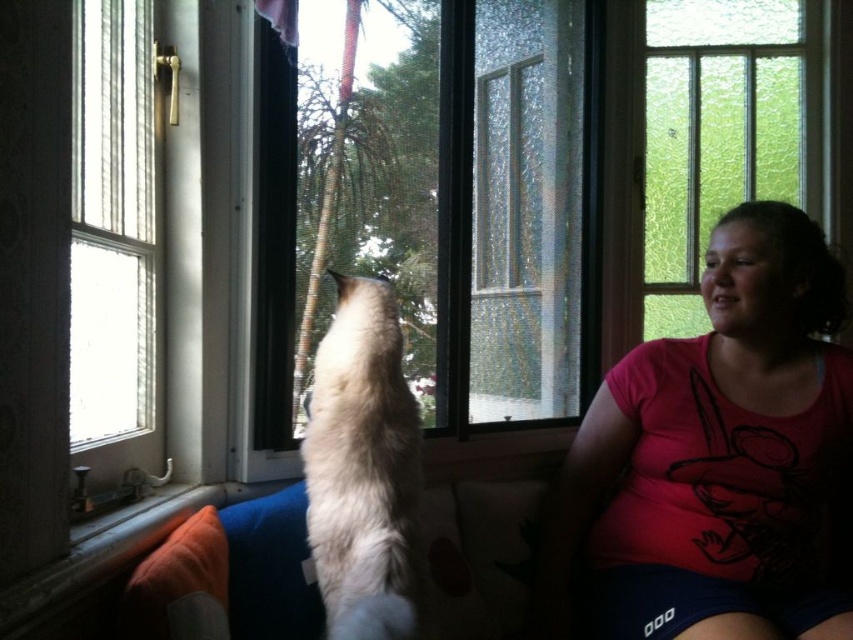
Question: Can you confirm if transparent glass window at center is wider than clear glass window at left?

Choices:
 (A) no
 (B) yes

Answer: (B)

Question: Which point is farther to the camera?

Choices:
 (A) pink cotton shirt at right
 (B) transparent glass window at center
 (C) white fluffy cat at center

Answer: (B)

Question: Does pink cotton shirt at right appear on the left side of white fluffy cat at center?

Choices:
 (A) yes
 (B) no

Answer: (B)

Question: Is transparent glass window at center smaller than white fluffy cat at center?

Choices:
 (A) no
 (B) yes

Answer: (A)

Question: Which of the following is the farthest from the observer?

Choices:
 (A) white fluffy cat at center
 (B) transparent glass window at center

Answer: (B)

Question: Which of the following is the closest to the observer?

Choices:
 (A) (392, 365)
 (B) (807, 403)
 (C) (461, 122)

Answer: (A)